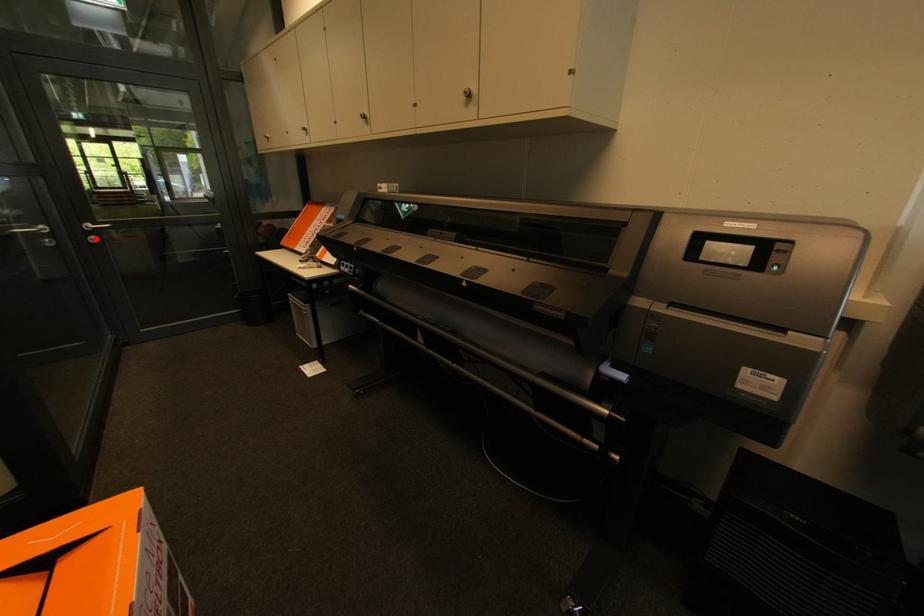
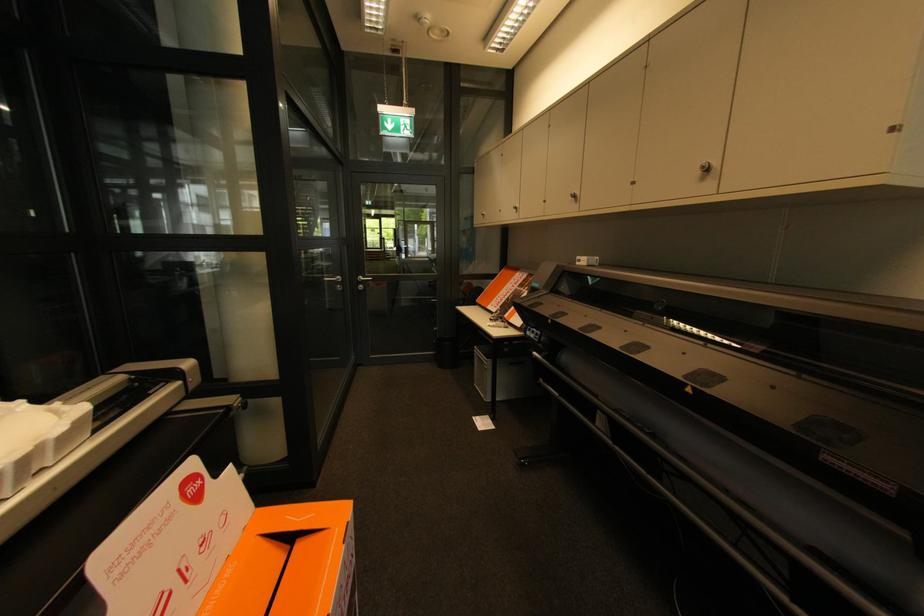
The point at the highlighted location is marked in the first image. Where is the corresponding point in the second image?

(365, 286)